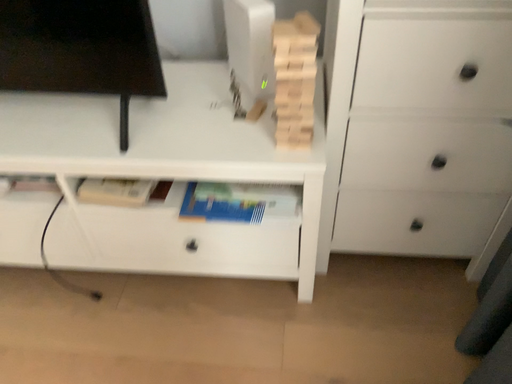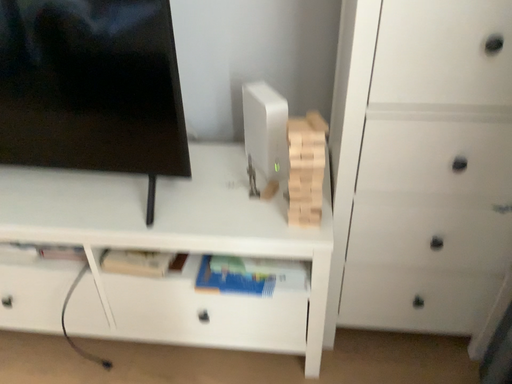
Question: How did the camera likely rotate when shooting the video?

Choices:
 (A) rotated upward
 (B) rotated downward

Answer: (A)